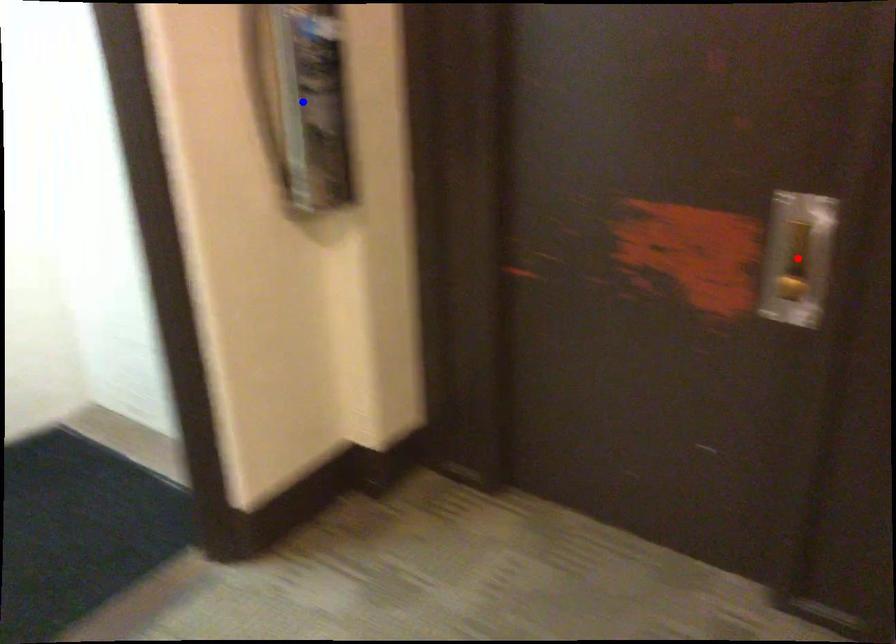
Question: Which of the two points in the image is closer to the camera?

Choices:
 (A) Blue point is closer.
 (B) Red point is closer.

Answer: (B)